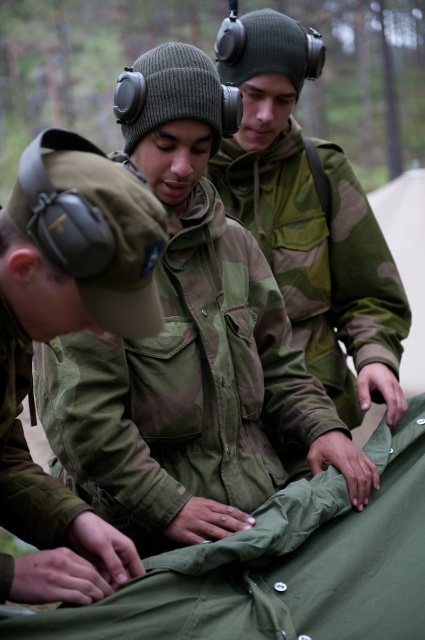
Question: Which object is positioned closest to the camouflage fabric jacket at upper center?

Choices:
 (A) matte green uniform at center
 (B) camouflage fabric jacket at center

Answer: (B)

Question: Which of the following is the farthest from the observer?

Choices:
 (A) (260, 470)
 (B) (229, 202)
 (C) (79, 186)

Answer: (B)

Question: Which of the following is the farthest from the observer?

Choices:
 (A) (297, 371)
 (B) (328, 326)
 (C) (28, 465)

Answer: (B)

Question: In this image, where is matte green uniform at center located relative to camouflage fabric jacket at upper center?

Choices:
 (A) right
 (B) left

Answer: (B)

Question: Can you confirm if camouflage fabric jacket at center is positioned below matte green uniform at center?

Choices:
 (A) yes
 (B) no

Answer: (B)

Question: Is matte green uniform at center positioned in front of camouflage fabric jacket at upper center?

Choices:
 (A) no
 (B) yes

Answer: (B)